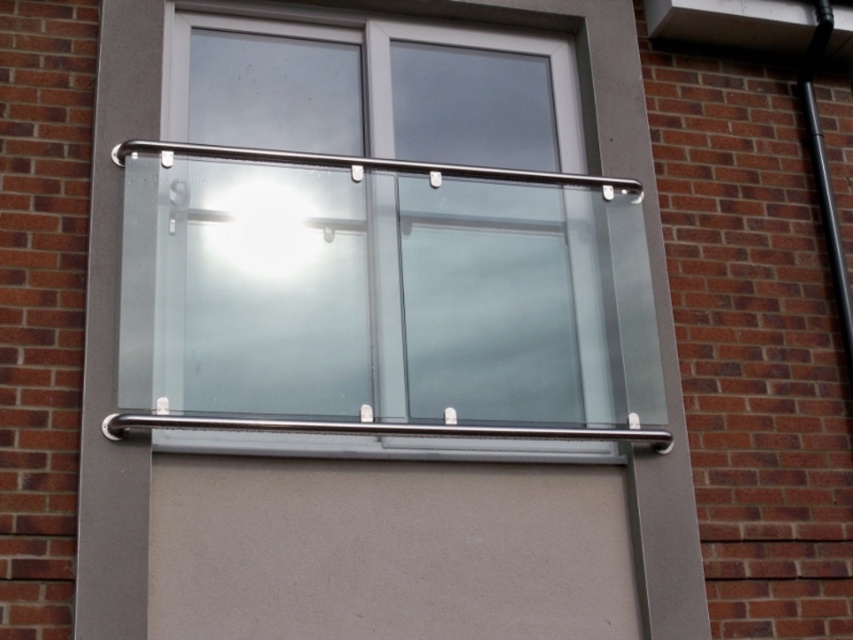
Is clear glass window at center below satin stainless steel handrail at upper center?

Indeed, clear glass window at center is positioned under satin stainless steel handrail at upper center.

Measure the distance between clear glass window at center and camera.

9.99 feet

Between point (503, 60) and point (502, 170), which one is positioned in front?

Point (502, 170)

Locate an element on the screen. Image resolution: width=853 pixels, height=640 pixels. clear glass window at center is located at coordinates (363, 230).

Between satin stainless steel handrail at center and satin stainless steel handrail at upper center, which one has more height?

satin stainless steel handrail at center is taller.

Is satin stainless steel handrail at center wider than satin stainless steel handrail at upper center?

Yes, satin stainless steel handrail at center is wider than satin stainless steel handrail at upper center.

In the scene shown: Who is more distant from viewer, (416, 426) or (427, 172)?

The point (427, 172) is more distant.

Locate an element on the screen. This screenshot has height=640, width=853. satin stainless steel handrail at center is located at coordinates (x=383, y=428).

Does point (178, 202) come in front of point (370, 429)?

That is False.

Is clear glass window at center wider than satin stainless steel handrail at center?

No.

The image size is (853, 640). Find the location of `clear glass window at center`. clear glass window at center is located at coordinates (363, 230).

Locate an element on the screen. This screenshot has height=640, width=853. clear glass window at center is located at coordinates (363, 230).